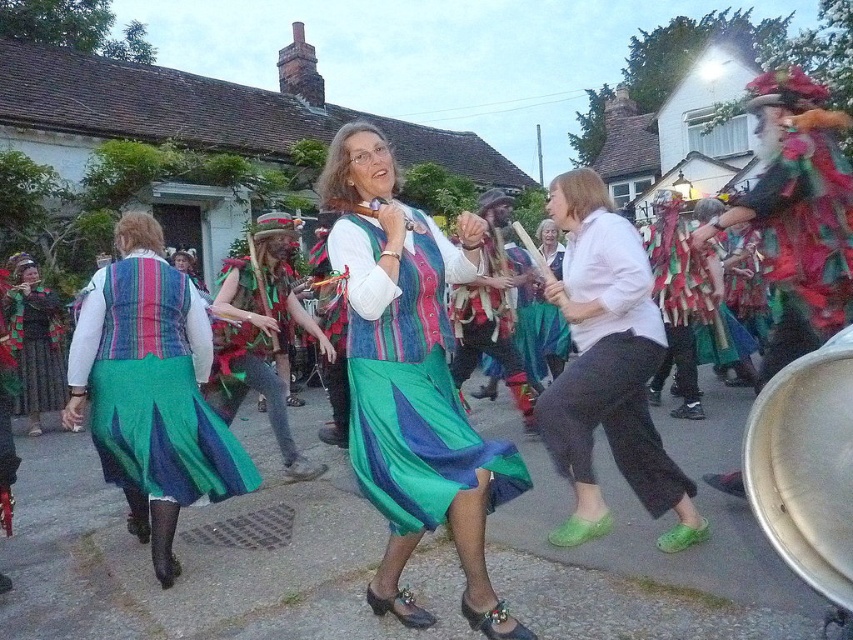
Question: Is denim vest at center further to the viewer compared to green textured skirt at left?

Choices:
 (A) no
 (B) yes

Answer: (A)

Question: Is matte multicolored dress at center smaller than white cotton shirt at center?

Choices:
 (A) no
 (B) yes

Answer: (A)

Question: Which is nearer to the white cotton shirt at center?

Choices:
 (A) matte multicolored dress at center
 (B) green satin skirt at center

Answer: (A)

Question: Considering the real-world distances, which object is farthest from the velvet green robe at right?

Choices:
 (A) denim vest at center
 (B) white cotton shirt at center
 (C) green satin skirt at center
 (D) green textured skirt at left

Answer: (D)

Question: Does denim vest at center appear over green textured skirt at left?

Choices:
 (A) no
 (B) yes

Answer: (A)

Question: Among these objects, which one is nearest to the camera?

Choices:
 (A) green textured skirt at left
 (B) matte multicolored dress at center

Answer: (B)